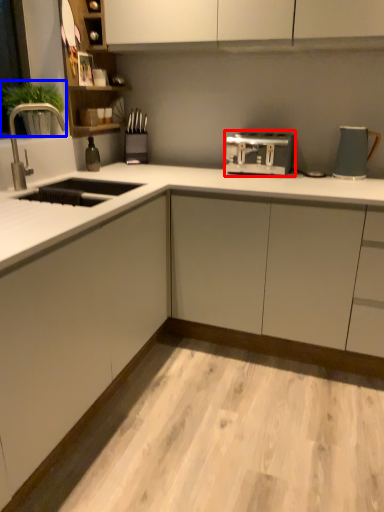
Question: Which of the following is the farthest to the observer, home appliance (highlighted by a red box) or plant (highlighted by a blue box)?

Choices:
 (A) home appliance
 (B) plant

Answer: (A)